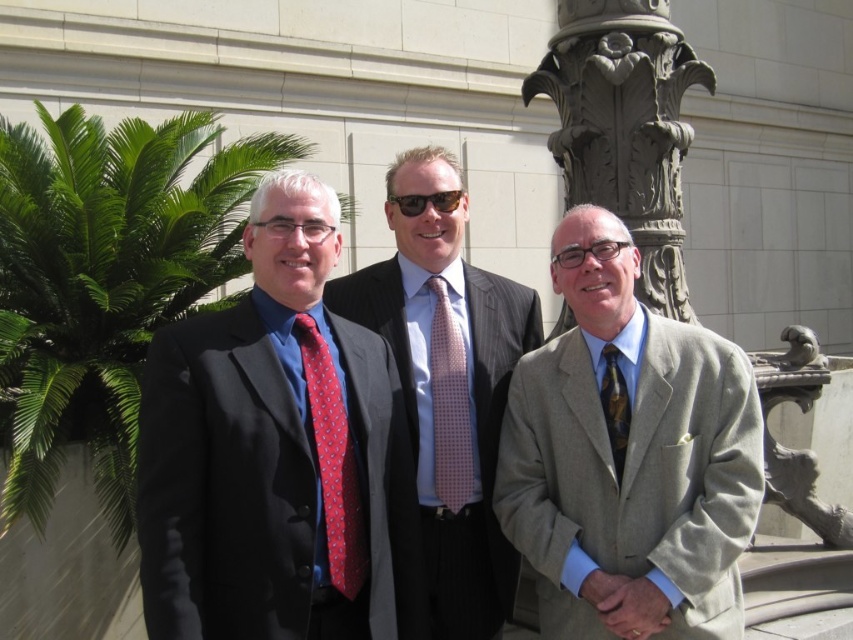
Which of these two, matte black suit at left or gold textured tie at center, stands taller?

Standing taller between the two is gold textured tie at center.

Can you confirm if matte black suit at left is wider than gold textured tie at center?

Indeed, matte black suit at left has a greater width compared to gold textured tie at center.

Is point (262, 452) positioned in front of point (628, 417)?

That is True.

The image size is (853, 640). Find the location of `matte black suit at left`. matte black suit at left is located at coordinates point(268,449).

Which is above, polished gray suit at center or pink dotted fabric tie at center?

polished gray suit at center is higher up.

You are a GUI agent. You are given a task and a screenshot of the screen. Output one action in this format:
    pyautogui.click(x=<x>, y=<y>)
    Task: Click on the polished gray suit at center
    The height and width of the screenshot is (640, 853).
    Given the screenshot: What is the action you would take?
    pyautogui.click(x=447, y=385)

Is green leafy palm tree at left below polished gray suit at center?

Actually, green leafy palm tree at left is above polished gray suit at center.

Between green leafy palm tree at left and polished gray suit at center, which one is positioned higher?

green leafy palm tree at left

Where is `green leafy palm tree at left`? green leafy palm tree at left is located at coordinates (105, 282).